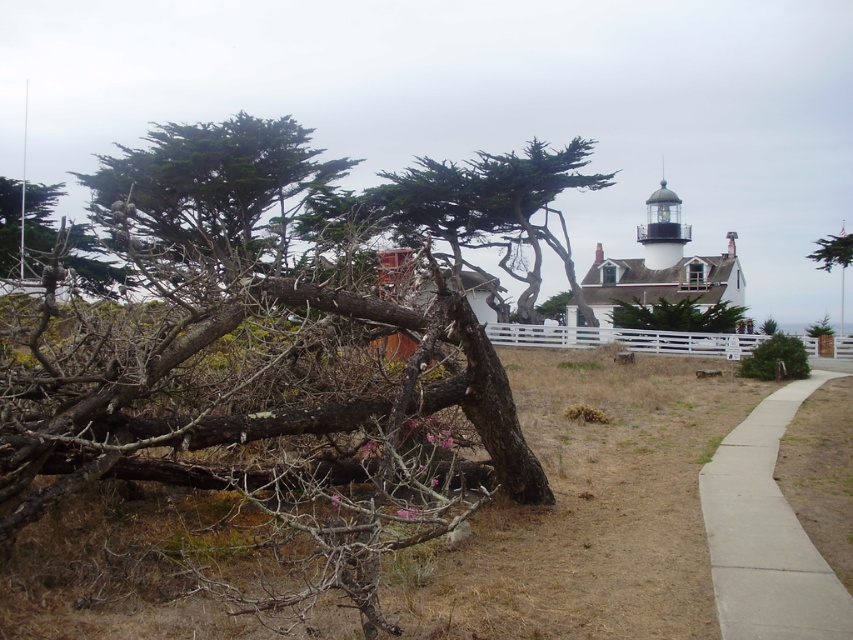
You are a maintenance worker needing to access the lighthouse. You see the concrete sidewalk at lower right and the white wooden fence at center. Which object is closer to the lighthouse?

The white wooden fence at center is closer to the lighthouse because the concrete sidewalk at lower right is located below it, meaning the fence is between the sidewalk and the lighthouse.

You are a maintenance worker needing to repair the concrete sidewalk at lower right and the white wooden fence at center. Based on the scene description, which object requires more material due to its size?

The white wooden fence at center requires more material because it is larger than the concrete sidewalk at lower right.